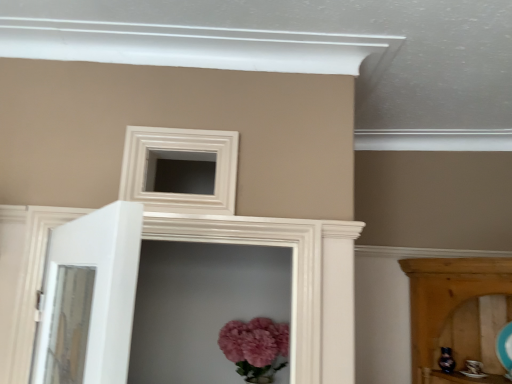
Locate an element on the screen. pink matte flower at lower center is located at coordinates (254, 342).

What do you see at coordinates (254, 342) in the screenshot?
I see `pink matte flower at lower center` at bounding box center [254, 342].

In order to face pink matte flower at lower center, should I rotate leftwards or rightwards?

You should rotate left by 0.523 degrees.

This screenshot has height=384, width=512. What are the coordinates of `pink matte flower at lower center` in the screenshot? It's located at (254, 342).